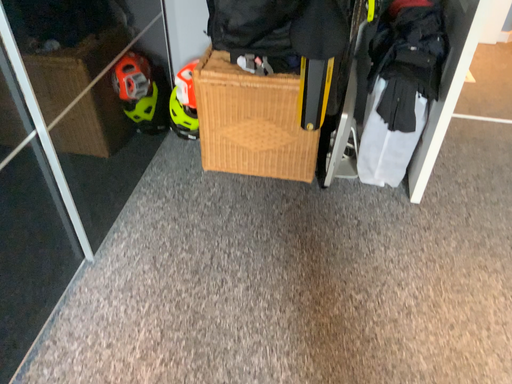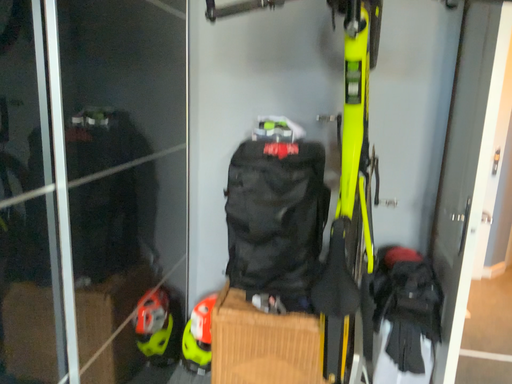
Question: Which way did the camera rotate in the video?

Choices:
 (A) rotated upward
 (B) rotated downward

Answer: (A)